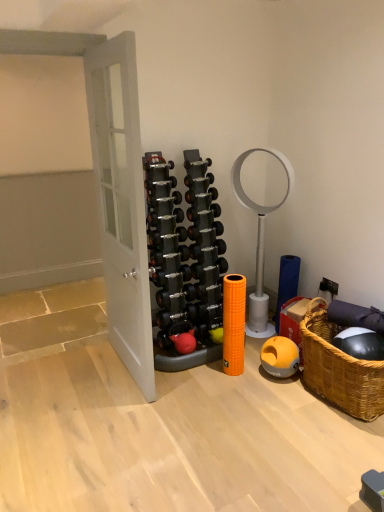
You are a GUI agent. You are given a task and a screenshot of the screen. Output one action in this format:
    pyautogui.click(x=<x>, y=<y>)
    Task: Click on the free region on the left part of orange rubber dumbbell at lower right, the 16th dumbbell from the top
    
    Given the screenshot: What is the action you would take?
    pyautogui.click(x=256, y=377)